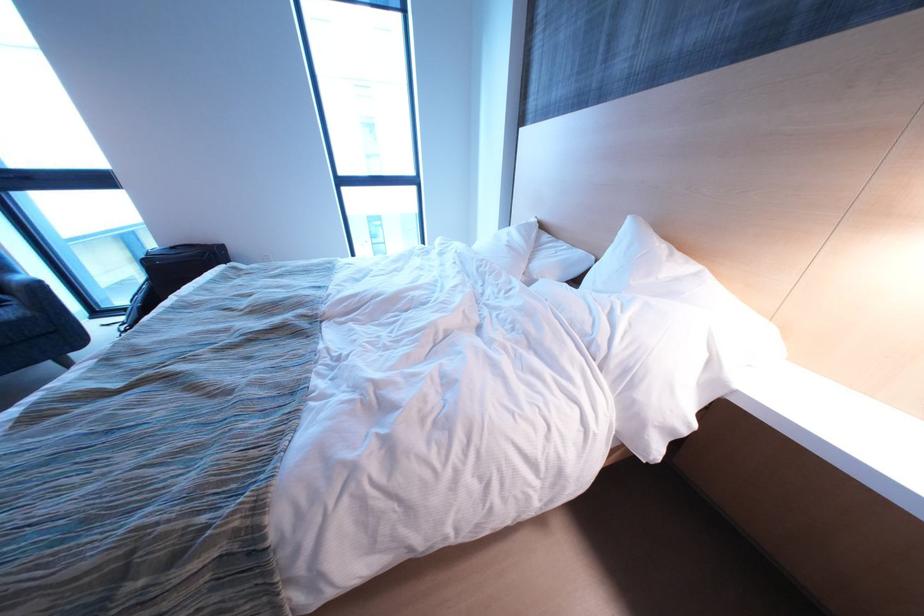
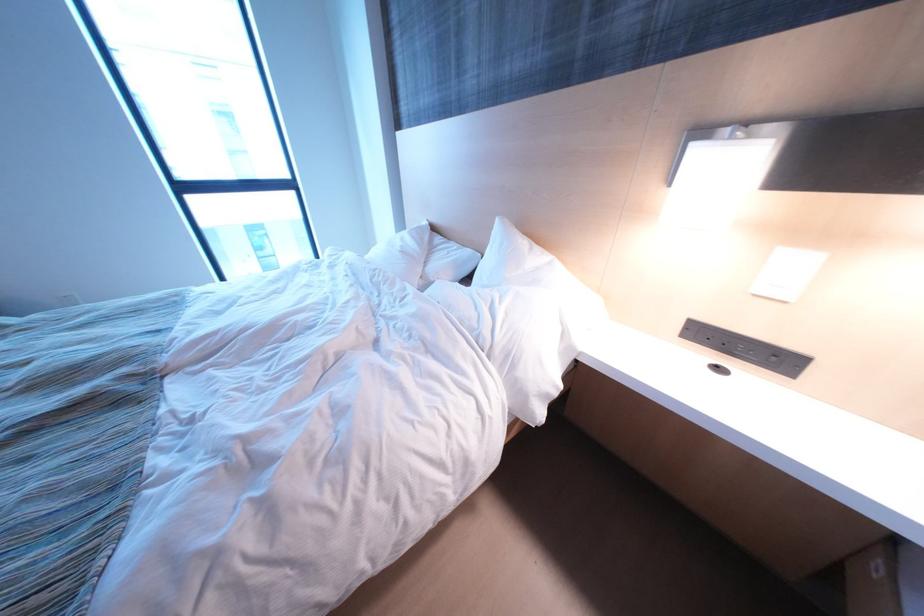
Question: The images are taken continuously from a first-person perspective. In which direction is your viewpoint rotating?

Choices:
 (A) Left
 (B) Right
 (C) Up
 (D) Down

Answer: (B)